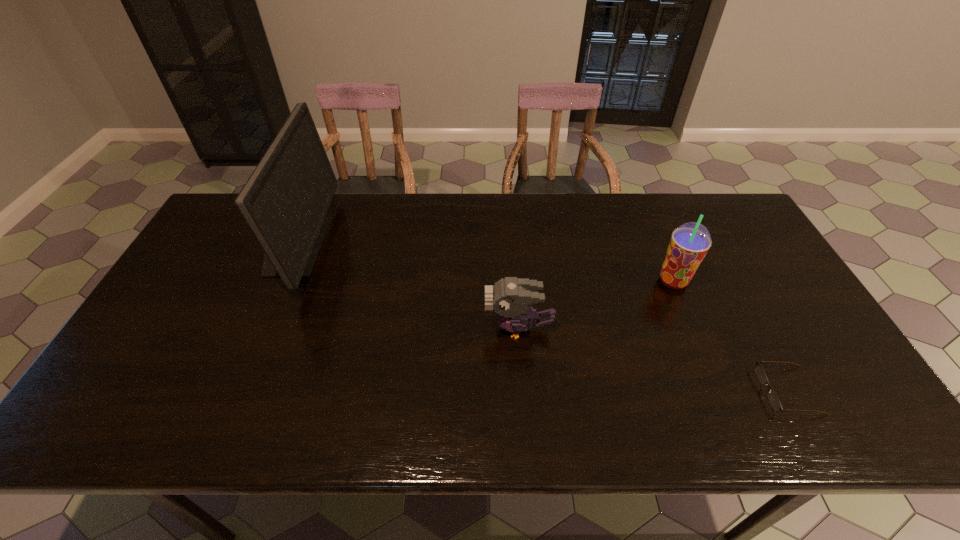
The image size is (960, 540). I want to click on vacant point located between the shortest object and the third farthest object, so click(x=654, y=360).

This screenshot has height=540, width=960. I want to click on free spot between the smoothie and the third farthest object, so click(596, 305).

Where is `free space between the leftmost object and the second shortest object`? The width and height of the screenshot is (960, 540). free space between the leftmost object and the second shortest object is located at coordinates (407, 286).

The height and width of the screenshot is (540, 960). Identify the location of free area in between the rightmost object and the smoothie. (731, 336).

Where is `free space that is in between the second nearest object and the tallest object`? free space that is in between the second nearest object and the tallest object is located at coordinates (407, 286).

Where is `object that can be found as the second closest to the third tallest object`? object that can be found as the second closest to the third tallest object is located at coordinates (759, 371).

The image size is (960, 540). What are the coordinates of `object that is the second closest to the smoothie` in the screenshot? It's located at pyautogui.click(x=509, y=297).

Identify the location of vacant space that satisfies the following two spatial constraints: 1. on the screen side of the third shortest object; 2. on the right side of the computer monitor. (279, 281).

Where is `free spot that satisfies the following two spatial constraints: 1. on the screen side of the third shortest object; 2. on the right side of the tallest object`? This screenshot has width=960, height=540. free spot that satisfies the following two spatial constraints: 1. on the screen side of the third shortest object; 2. on the right side of the tallest object is located at coordinates (279, 281).